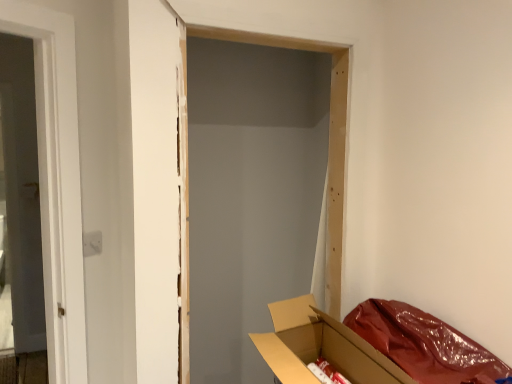
Measure the distance between point (286, 369) and camera.

They are 1.23 meters apart.

What do you see at coordinates (320, 346) in the screenshot? This screenshot has width=512, height=384. I see `cardboard box at lower right` at bounding box center [320, 346].

Image resolution: width=512 pixels, height=384 pixels. Identify the location of cardboard box at lower right. (320, 346).

Identify the location of white fabric curtain at right. The height and width of the screenshot is (384, 512). (320, 253).

What do you see at coordinates (320, 253) in the screenshot?
I see `white fabric curtain at right` at bounding box center [320, 253].

Where is `cardboard box at lower right`? cardboard box at lower right is located at coordinates (320, 346).

Between cardboard box at lower right and white fabric curtain at right, which one appears on the right side from the viewer's perspective?

white fabric curtain at right is more to the right.

Does cardboard box at lower right lie behind white fabric curtain at right?

No, the depth of cardboard box at lower right is less than that of white fabric curtain at right.

Is point (398, 368) closer to viewer compared to point (321, 221)?

Yes, it is in front of point (321, 221).

From the image's perspective, between cardboard box at lower right and white fabric curtain at right, who is located below?

cardboard box at lower right, from the image's perspective.

From a real-world perspective, is cardboard box at lower right positioned under white fabric curtain at right based on gravity?

Yes, from a real-world perspective, cardboard box at lower right is beneath white fabric curtain at right.

Does cardboard box at lower right have a greater width compared to white fabric curtain at right?

Indeed, cardboard box at lower right has a greater width compared to white fabric curtain at right.

Which of these two, cardboard box at lower right or white fabric curtain at right, stands taller?

white fabric curtain at right is taller.

Which of these two, cardboard box at lower right or white fabric curtain at right, is smaller?

Smaller between the two is white fabric curtain at right.

Which is correct: cardboard box at lower right is inside white fabric curtain at right, or outside of it?

cardboard box at lower right is located beyond the bounds of white fabric curtain at right.

From the picture: Does cardboard box at lower right touch white fabric curtain at right?

There is a gap between cardboard box at lower right and white fabric curtain at right.

Is cardboard box at lower right turned away from white fabric curtain at right?

No.

Find the location of a particular element. box in front of the white fabric curtain at right is located at coordinates (320, 346).

Can you confirm if white fabric curtain at right is positioned to the left of cardboard box at lower right?

No, white fabric curtain at right is not to the left of cardboard box at lower right.

Is white fabric curtain at right closer to camera compared to cardboard box at lower right?

That is False.

Which is nearer, (325, 231) or (368, 352)?

Point (325, 231).

From the image's perspective, is white fabric curtain at right located beneath cardboard box at lower right?

No, from the image's perspective, white fabric curtain at right is not beneath cardboard box at lower right.

From a real-world perspective, relative to cardboard box at lower right, is white fabric curtain at right vertically above or below?

From a real-world perspective, white fabric curtain at right is physically above cardboard box at lower right.

Which of these two, white fabric curtain at right or cardboard box at lower right, is wider?

cardboard box at lower right.

Who is shorter, white fabric curtain at right or cardboard box at lower right?

cardboard box at lower right is shorter.

Does white fabric curtain at right have a larger size compared to cardboard box at lower right?

Actually, white fabric curtain at right might be smaller than cardboard box at lower right.

Would you say white fabric curtain at right is outside cardboard box at lower right?

Indeed, white fabric curtain at right is completely outside cardboard box at lower right.

Is white fabric curtain at right next to cardboard box at lower right?

No, white fabric curtain at right is not with cardboard box at lower right.

Could you tell me if white fabric curtain at right is facing cardboard box at lower right?

No, white fabric curtain at right is not facing towards cardboard box at lower right.

From the picture: How distant is white fabric curtain at right from cardboard box at lower right?

11.85 inches.

At what (x,y) coordinates should I click in order to perform the action: click on box in front of the white fabric curtain at right. Please return your answer as a coordinate pair (x, y). This screenshot has height=384, width=512. Looking at the image, I should click on [320, 346].

You are a GUI agent. You are given a task and a screenshot of the screen. Output one action in this format:
    pyautogui.click(x=<x>, y=<y>)
    Task: Click on the box located on the left of white fabric curtain at right
    Image resolution: width=512 pixels, height=384 pixels.
    Given the screenshot: What is the action you would take?
    (320, 346)

I want to click on box in front of the white fabric curtain at right, so click(320, 346).